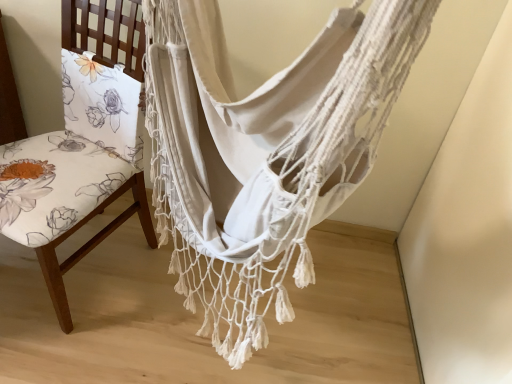
Question: Considering their positions, is floral fabric chair at left located in front of or behind white woven hammock at center?

Choices:
 (A) behind
 (B) front

Answer: (A)

Question: Is point pos(72,263) positioned closer to the camera than point pos(218,253)?

Choices:
 (A) farther
 (B) closer

Answer: (A)

Question: In terms of size, does floral fabric chair at left appear bigger or smaller than white woven hammock at center?

Choices:
 (A) small
 (B) big

Answer: (A)

Question: Considering the positions of white woven hammock at center and floral fabric chair at left in the image, is white woven hammock at center taller or shorter than floral fabric chair at left?

Choices:
 (A) short
 (B) tall

Answer: (A)

Question: From the image's perspective, is white woven hammock at center located above or below floral fabric chair at left?

Choices:
 (A) below
 (B) above

Answer: (A)

Question: Relative to floral fabric chair at left, is white woven hammock at center in front or behind?

Choices:
 (A) behind
 (B) front

Answer: (B)

Question: Is point (278, 213) positioned closer to the camera than point (55, 301)?

Choices:
 (A) closer
 (B) farther

Answer: (A)